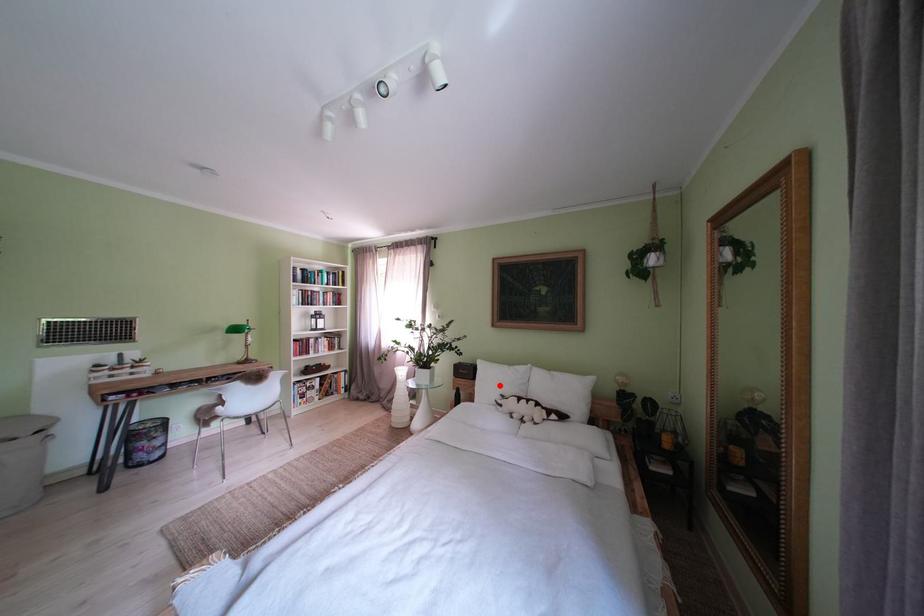
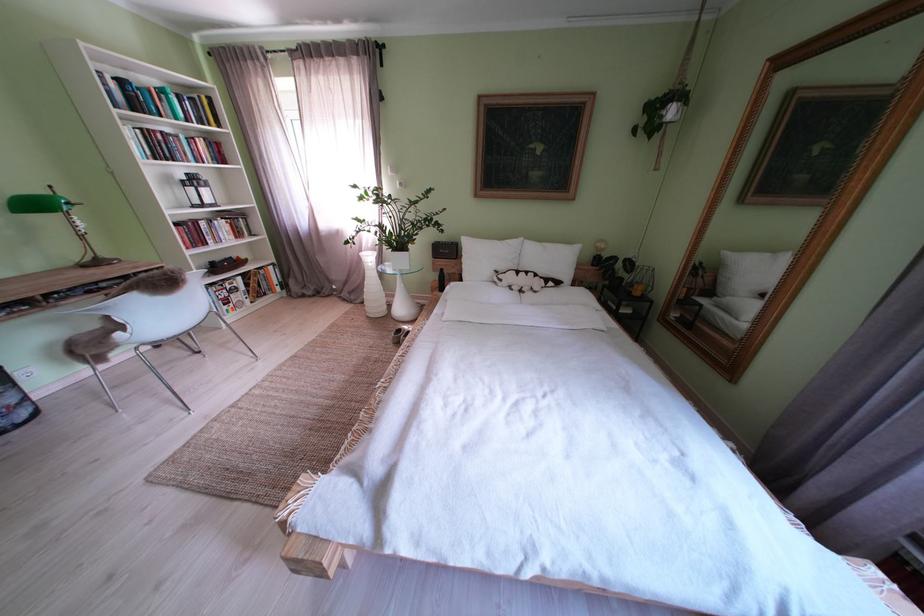
Question: I am providing you with two images of the same scene from different viewpoints. A red point is shown in image1. For the corresponding object point in image2, is it positioned nearer or farther from the camera?

Choices:
 (A) Nearer
 (B) Farther

Answer: (A)